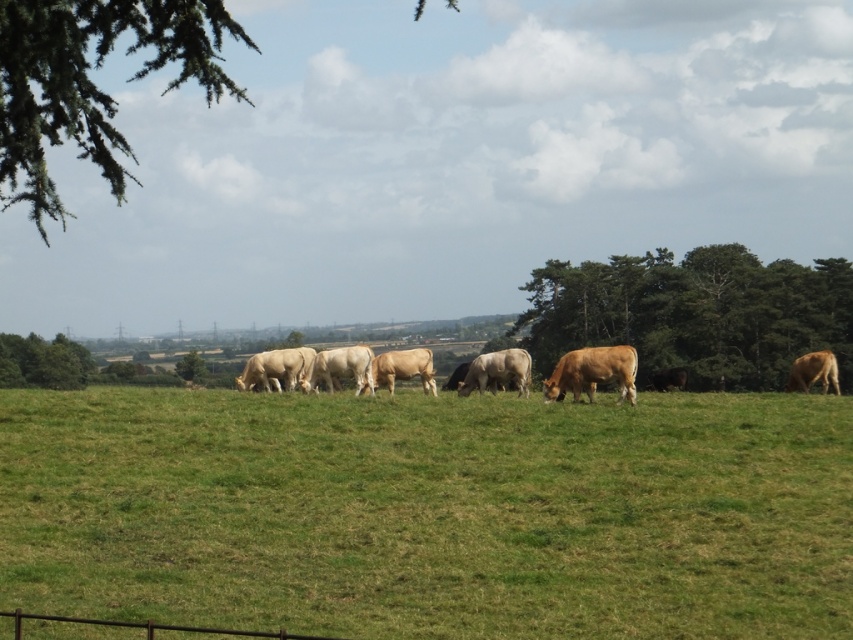
You are a farmer checking the pasture. You notice the green leafy tree at left and the light brown cow at center. Which object is positioned lower in the image?

The green leafy tree at left is positioned lower than the light brown cow at center in the image.